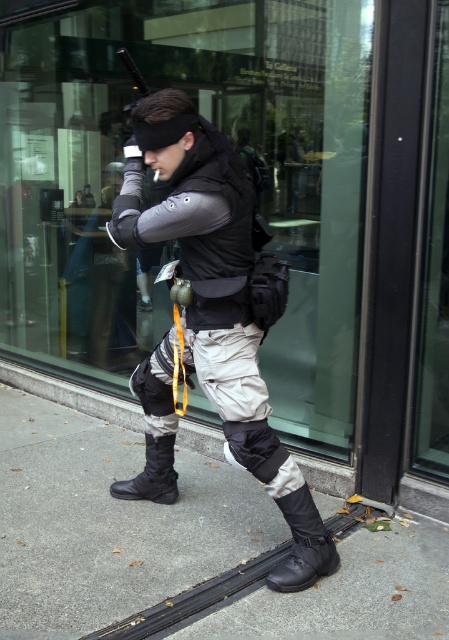
Question: Which of the following is the closest to the observer?

Choices:
 (A) black leather boot at lower center
 (B) matte black vest at center

Answer: (B)

Question: From the image, what is the correct spatial relationship of transparent glass at center in relation to black leather boot at lower center?

Choices:
 (A) right
 (B) left

Answer: (B)

Question: Is gray concrete sidewalk at center smaller than matte black vest at center?

Choices:
 (A) yes
 (B) no

Answer: (B)

Question: Which of the following is the farthest from the observer?

Choices:
 (A) gray concrete sidewalk at center
 (B) matte black vest at center
 (C) black matte boot at lower left

Answer: (C)

Question: Among these points, which one is farthest from the camera?

Choices:
 (A) (304, 552)
 (B) (215, 266)
 (C) (140, 440)

Answer: (C)

Question: Does gray concrete sidewalk at center have a smaller size compared to black matte boot at lower left?

Choices:
 (A) no
 (B) yes

Answer: (A)